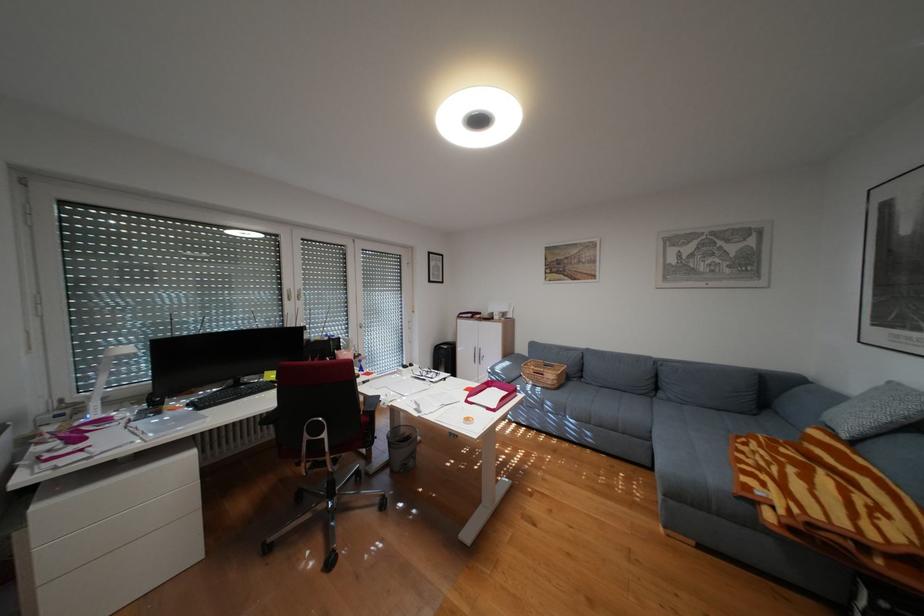
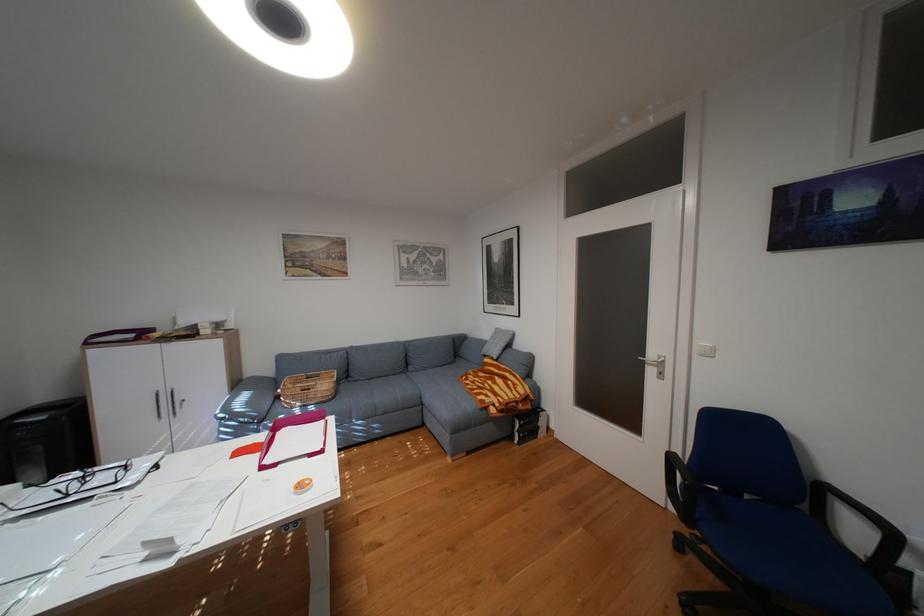
Find the pixel in the second image that matches [491,355] in the first image.

(180, 403)